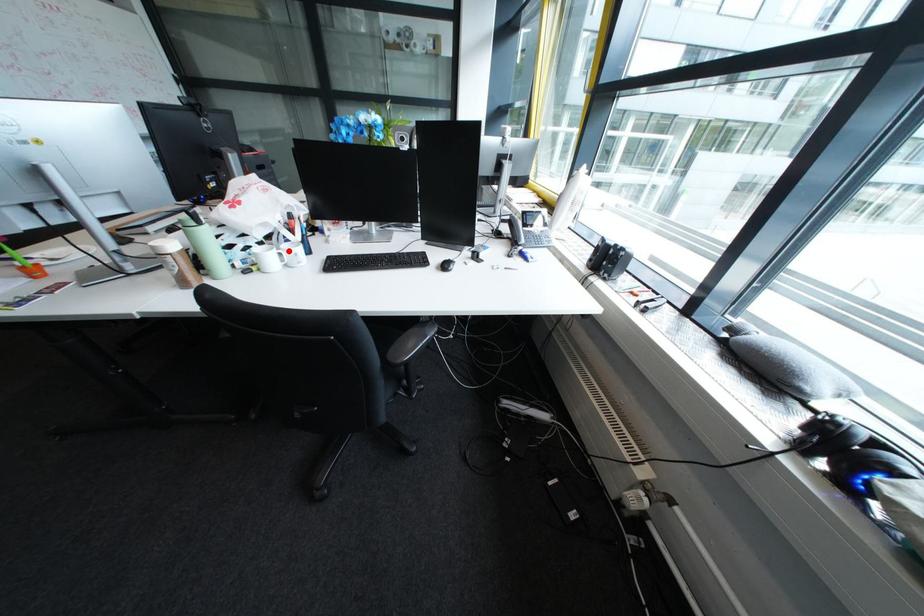
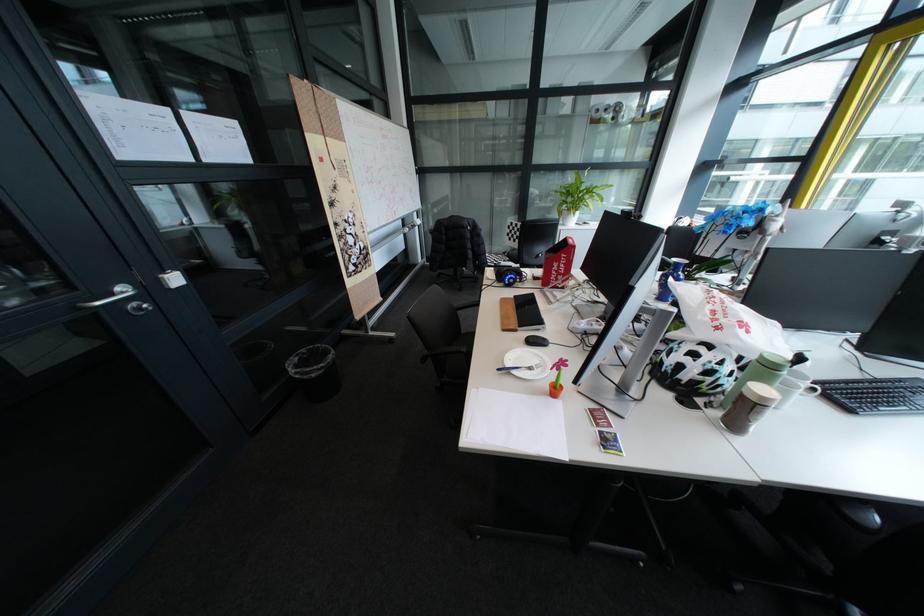
Find the pixel in the second image that matches the highlighted location in the first image.

(815, 386)